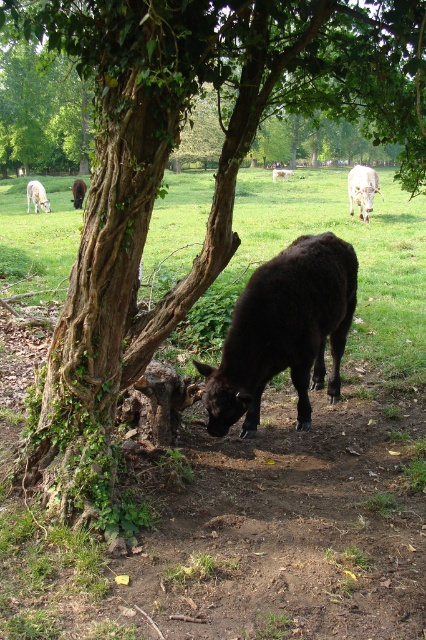
Is point (340, 316) more distant than point (284, 172)?

No, it is in front of (284, 172).

Who is more distant from viewer, (258, 291) or (273, 170)?

The point (273, 170) is behind.

I want to click on black woolly sheep at lower center, so click(284, 332).

Does white glossy cow at upper right have a lesser width compared to white woolly sheep at upper left?

Yes, white glossy cow at upper right is thinner than white woolly sheep at upper left.

Does point (360, 196) come behind point (40, 184)?

No, it is not.

Identify the location of white glossy cow at upper right. (362, 189).

Does black woolly sheep at lower center appear over white woolly sheep at upper left?

No.

Does black woolly sheep at lower center have a greater height compared to white woolly sheep at upper left?

Yes, black woolly sheep at lower center is taller than white woolly sheep at upper left.

Locate an element on the screen. This screenshot has width=426, height=640. black woolly sheep at lower center is located at coordinates 284,332.

The width and height of the screenshot is (426, 640). I want to click on black woolly sheep at lower center, so click(x=284, y=332).